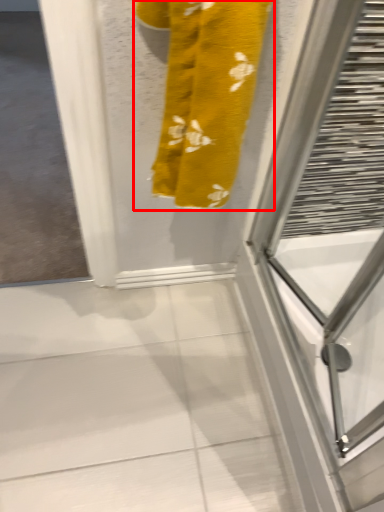
Question: In this image, where is towel (annotated by the red box) located relative to screen door?

Choices:
 (A) right
 (B) left

Answer: (B)